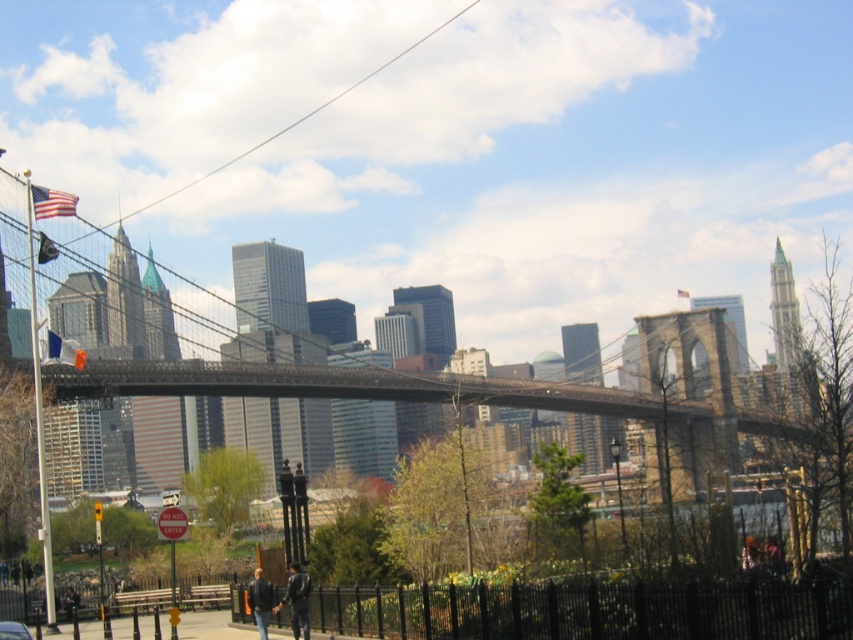
You are a photographer standing in the park at the bottom of the image. You want to take a photo that includes both the metallic gray suspension bridge at center and the metallic silver car at lower left. Which object should you position closer to the top of your camera frame?

You should position the metallic gray suspension bridge at center closer to the top of your camera frame because it is taller than the metallic silver car at lower left.

Looking at this image, you are standing at the point closest to the bottom edge of the Brooklyn Bridge scene. Which of the two points, point (54, 221) or point (15, 634), is farther away from you?

Point (54, 221) is farther away from you because it is behind point (15, 634).